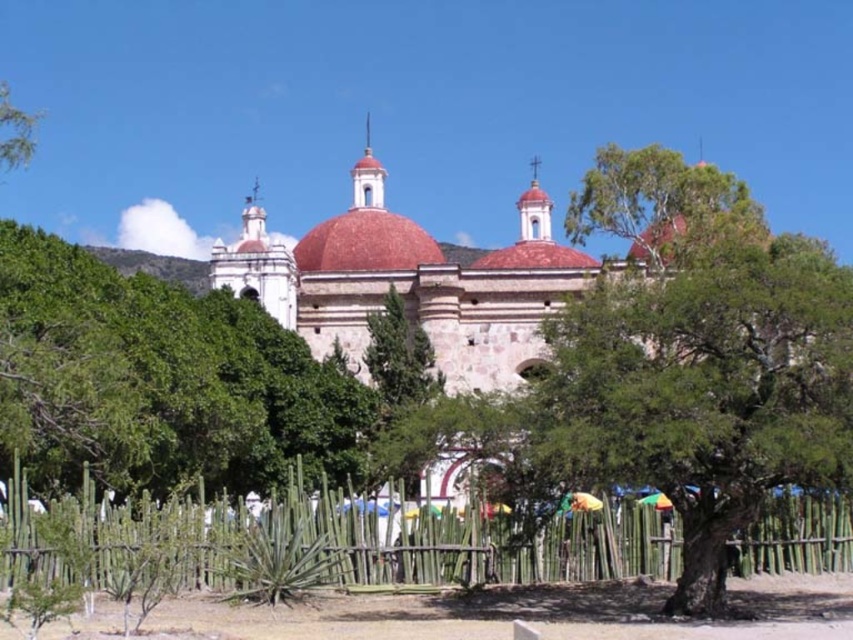
You are planning to install a new pathway between the green leafy tree at center and the green bamboo fence at lower center. The pathway requires a minimum of 30 feet of space to be safe. Based on the scene, is the current distance sufficient?

The distance between the green leafy tree at center and the green bamboo fence at lower center is 29.61 feet, which is slightly less than the required 30 feet. Therefore, the current distance is not sufficient for a safe pathway.

You are standing at the edge of the scene and want to take a photo of the green leafy tree at center and the green bamboo fence at lower center. Which object should you focus on first if you want to capture both in your frame?

You should focus on the green bamboo fence at lower center first because it is closer to you than the green leafy tree at center, which is above it.

You are standing at a viewpoint overlooking the historic church with a red dome. There is a point marked at coordinates point (7, 465). Can you estimate how far this point is from your current position in meters?

The point (7, 465) is 87.70 meters away from the viewer.